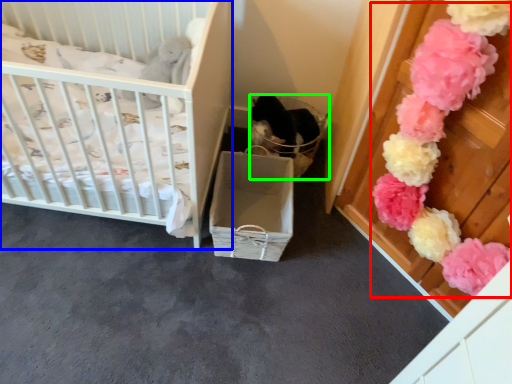
Question: Which object is positioned closest to flower (highlighted by a red box)? Select from infant bed (highlighted by a blue box) and basket (highlighted by a green box).

Choices:
 (A) infant bed
 (B) basket

Answer: (B)